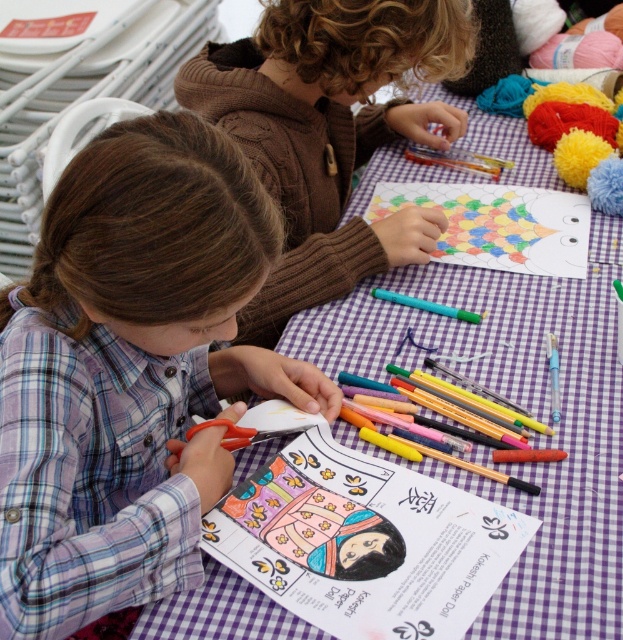
You are a tailor who needs to determine which clothing item has a smaller width to fit into a narrow drawer. Based on the scene, which clothing item between the plaid fabric shirt at center and the brown knitted sweater at upper center would you choose?

The plaid fabric shirt at center is thinner than the brown knitted sweater at upper center, so you should choose the plaid fabric shirt at center as it has a smaller width and will fit into the narrow drawer.

You are a photographer standing at a certain distance from the table. You want to take a closeup photo of the plaid fabric shirt at center without any obstructions. The camera you are using has a minimum focusing distance of 23 inches. Based on the scene description, will you be able to take the photo?

The plaid fabric shirt at center and camera are 22.97 inches apart, which is less than the camera minimum focusing distance of 23 inches. Therefore, the photographer cannot take the photo because the camera cannot focus that close.

You are a teacher observing the children at the table. You need to determine which object is taller between the plaid fabric shirt at center and the colored paper drawing at center. Which one is taller?

The plaid fabric shirt at center is taller than the colored paper drawing at center according to the description.